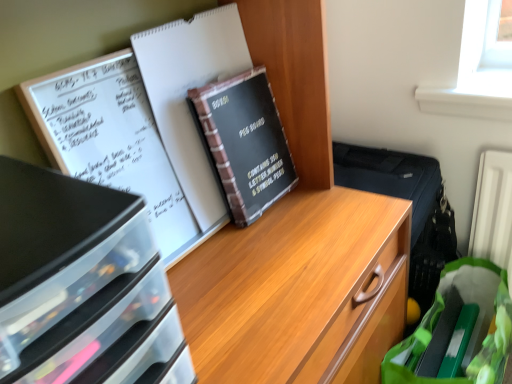
Image resolution: width=512 pixels, height=384 pixels. Identify the location of black matte peg board at center. (245, 142).

Is point (489, 377) less distant than point (248, 125)?

No, (489, 377) is behind (248, 125).

Can you confirm if green fabric grocery bag at lower right is shorter than black matte peg board at center?

In fact, green fabric grocery bag at lower right may be taller than black matte peg board at center.

How much distance is there between green fabric grocery bag at lower right and black matte peg board at center?

green fabric grocery bag at lower right is 24.55 inches from black matte peg board at center.

Considering their positions, is green fabric grocery bag at lower right located in front of or behind black matte peg board at center?

Clearly, green fabric grocery bag at lower right is behind black matte peg board at center.

The image size is (512, 384). Identify the location of grocery bag behind the black matte peg board at center. (457, 329).

From their relative heights in the image, would you say black matte peg board at center is taller or shorter than green fabric grocery bag at lower right?

In the image, black matte peg board at center appears to be shorter than green fabric grocery bag at lower right.

Can we say black matte peg board at center lies outside green fabric grocery bag at lower right?

black matte peg board at center lies outside green fabric grocery bag at lower right's area.

Is black matte peg board at center wider than green fabric grocery bag at lower right?

No.

Is black plastic drawers at left bigger than green fabric grocery bag at lower right?

Incorrect, black plastic drawers at left is not larger than green fabric grocery bag at lower right.

Where is `desk on the left side of green fabric grocery bag at lower right`? The image size is (512, 384). desk on the left side of green fabric grocery bag at lower right is located at coordinates (82, 286).

Does black plastic drawers at left have a lesser height compared to green fabric grocery bag at lower right?

Yes, black plastic drawers at left is shorter than green fabric grocery bag at lower right.

How much distance is there between black plastic drawers at left and green fabric grocery bag at lower right?

black plastic drawers at left is 32.07 inches away from green fabric grocery bag at lower right.

From the image's perspective, is black plastic drawers at left above or below black paper journal at center?

From the image's perspective, black plastic drawers at left appears below black paper journal at center.

Is black plastic drawers at left next to black paper journal at center?

No, black plastic drawers at left is not next to black paper journal at center.

Does black matte peg board at center have a greater width compared to black plastic drawers at left?

Incorrect, the width of black matte peg board at center does not surpass that of black plastic drawers at left.

Is point (253, 146) closer or farther from the camera than point (0, 310)?

Point (253, 146) is positioned farther from the camera compared to point (0, 310).

Can you tell me how much black matte peg board at center and black plastic drawers at left differ in facing direction?

0.411 degrees.

From a real-world perspective, which is physically above, black matte peg board at center or black plastic drawers at left?

From a 3D spatial view, black plastic drawers at left is above.

Based on the photo, which object is positioned more to the right, black matte peg board at center or black paper journal at center?

black matte peg board at center is more to the right.

Which object is closer to the camera taking this photo, black matte peg board at center or black paper journal at center?

black paper journal at center is in front.

Would you say black paper journal at center is part of black matte peg board at center's contents?

No, black paper journal at center is not a part of black matte peg board at center.

Consider the image. Is black paper journal at center bigger or smaller than black plastic drawers at left?

Clearly, black paper journal at center is smaller in size than black plastic drawers at left.

Considering the relative sizes of black paper journal at center and black plastic drawers at left in the image provided, is black paper journal at center shorter than black plastic drawers at left?

No.

Consider the image. Is black paper journal at center facing away from black plastic drawers at left?

No, black plastic drawers at left is not at the back of black paper journal at center.

At what (x,y) coordinates should I click in order to perform the action: click on book in front of the green fabric grocery bag at lower right. Please return your answer as a coordinate pair (x, y). The width and height of the screenshot is (512, 384). Looking at the image, I should click on (245, 142).

At what (x,y) coordinates should I click in order to perform the action: click on grocery bag below the black matte peg board at center (from the image's perspective). Please return your answer as a coordinate pair (x, y). The width and height of the screenshot is (512, 384). Looking at the image, I should click on (457, 329).

Based on the photo, which object lies further to the anchor point green fabric grocery bag at lower right, black paper journal at center or black plastic drawers at left?

black plastic drawers at left.

Estimate the real-world distances between objects in this image. Which object is closer to black paper journal at center, black matte peg board at center or green fabric grocery bag at lower right?

black matte peg board at center.

Which object lies nearer to the anchor point green fabric grocery bag at lower right, black paper journal at center or black matte peg board at center?

Based on the image, black matte peg board at center appears to be nearer to green fabric grocery bag at lower right.

When comparing their distances from black paper journal at center, does green fabric grocery bag at lower right or black plastic drawers at left seem closer?

black plastic drawers at left lies closer to black paper journal at center than the other object.

Looking at the image, which one is located closer to black plastic drawers at left, black paper journal at center or black matte peg board at center?

Among the two, black paper journal at center is located nearer to black plastic drawers at left.

Looking at the image, which one is located further to black matte peg board at center, green fabric grocery bag at lower right or black paper journal at center?

green fabric grocery bag at lower right is further to black matte peg board at center.

From the image, which object appears to be nearer to black matte peg board at center, black paper journal at center or black plastic drawers at left?

black paper journal at center is closer to black matte peg board at center.

Based on the photo, from the image, which object appears to be nearer to green fabric grocery bag at lower right, black matte peg board at center or black paper journal at center?

black matte peg board at center is positioned closer to the anchor green fabric grocery bag at lower right.

Where is `book between black plastic drawers at left and green fabric grocery bag at lower right in the horizontal direction`? This screenshot has height=384, width=512. book between black plastic drawers at left and green fabric grocery bag at lower right in the horizontal direction is located at coordinates (245, 142).

Where is `book between black paper journal at center and green fabric grocery bag at lower right`? The height and width of the screenshot is (384, 512). book between black paper journal at center and green fabric grocery bag at lower right is located at coordinates (245, 142).

You are a GUI agent. You are given a task and a screenshot of the screen. Output one action in this format:
    pyautogui.click(x=<x>, y=<y>)
    Task: Click on the journal situated between black plastic drawers at left and green fabric grocery bag at lower right from left to right
    This screenshot has height=384, width=512.
    Given the screenshot: What is the action you would take?
    pyautogui.click(x=187, y=93)

At what (x,y) coordinates should I click in order to perform the action: click on journal positioned between black plastic drawers at left and black matte peg board at center from near to far. Please return your answer as a coordinate pair (x, y). Looking at the image, I should click on (187, 93).